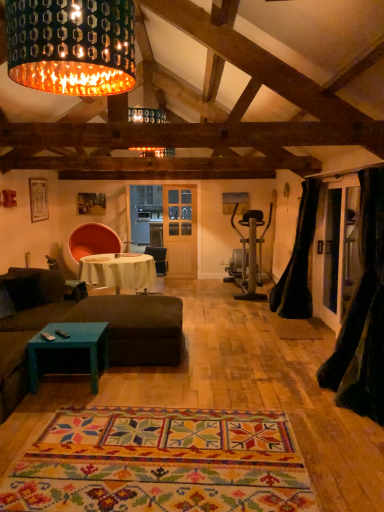
Question: From the image's perspective, is white cloth-covered table at center located above or below black velvet curtain at right, arranged as the 2th curtain when viewed from the back?

Choices:
 (A) above
 (B) below

Answer: (B)

Question: In terms of width, does white cloth-covered table at center look wider or thinner when compared to black velvet curtain at right, arranged as the 1th curtain when viewed from the front?

Choices:
 (A) thin
 (B) wide

Answer: (B)

Question: Based on their relative distances, which object is farther from the teal matte coffee table at lower left?

Choices:
 (A) white cloth-covered table at center
 (B) black velvet curtain at right, arranged as the 2th curtain when viewed from the back
 (C) dark brown fabric couch at center
 (D) multicolored woven rug at center
 (E) brown fabric couch at lower left

Answer: (A)

Question: Estimate the real-world distances between objects in this image. Which object is closer to the white cloth-covered table at center?

Choices:
 (A) brown fabric couch at lower left
 (B) dark brown fabric couch at center
 (C) metallic perforated shade at upper center
 (D) multicolored woven rug at center
 (E) black fabric guitar case at right, which is counted as the second curtain, starting from the front

Answer: (A)